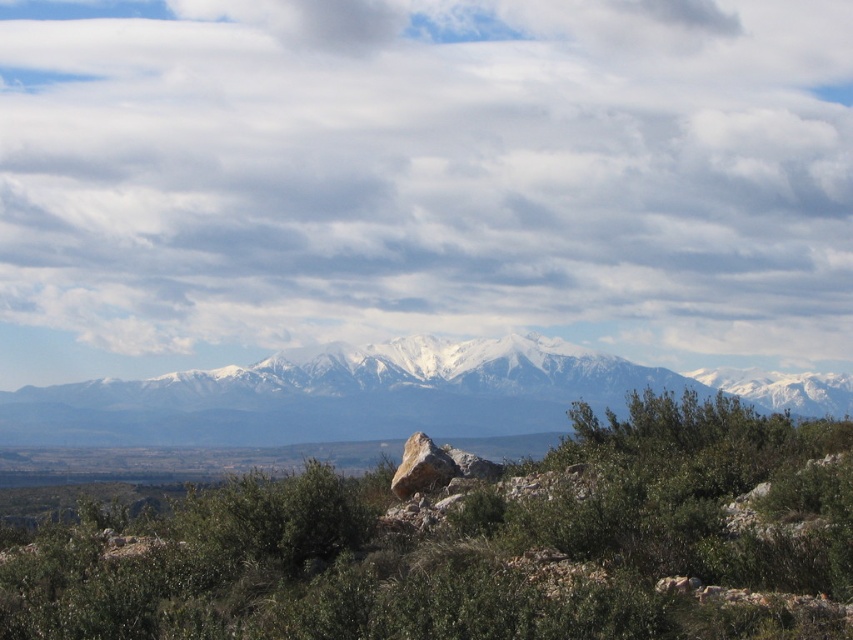
You are an airplane pilot preparing for takeoff. You notice the cloudy sky at upper center and the snowy white mountain range at center in the distance. According to aviation safety guidelines, which object should you prioritize checking for potential flight hazards?

The cloudy sky at upper center should be prioritized for checking potential flight hazards because it is located above the snowy white mountain range at center, which could indicate weather conditions affecting flight safety.

You are a hiker planning to take a photo of the snowy white mountain range at center. You notice the green leafy shrubs at center might block your view. Based on the scene, will the shrubs block the mountain range in your photo?

The green leafy shrubs at center are in front of the snowy white mountain range at center, so they will block the mountain range in your photo.

You are an airplane pilot flying over the mountainous landscape described. You need to determine the safest path between the cloudy sky at upper center and the snowy white mountain range at center. Which object is closer to your current altitude?

The cloudy sky at upper center is closer to your current altitude because the snowy white mountain range at center is positioned behind it.